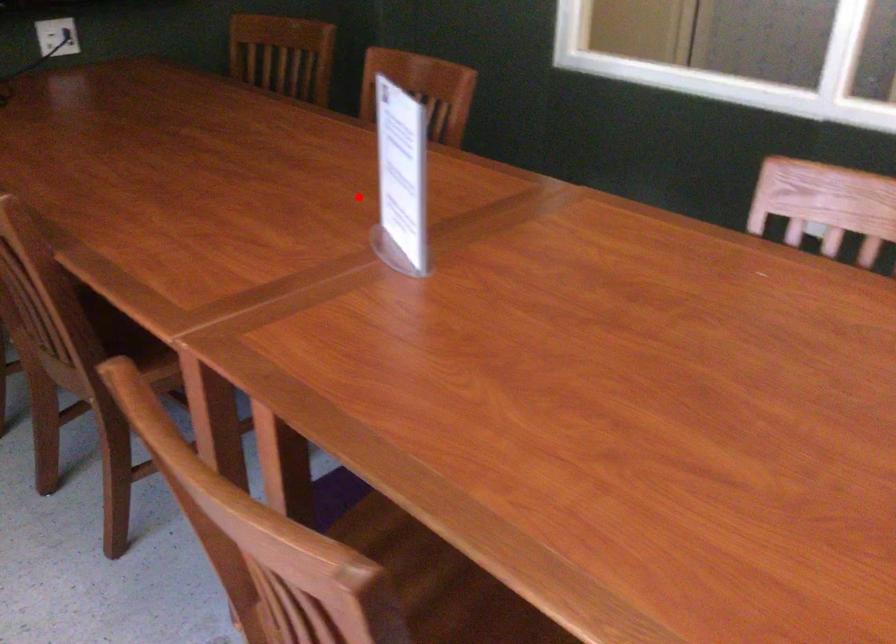
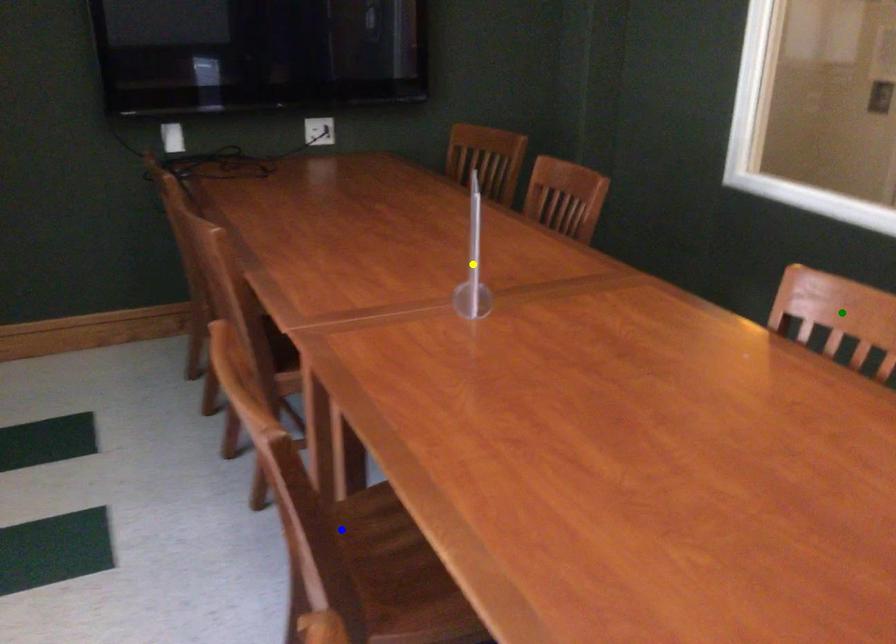
Question: I am providing you with two images of the same scene from different viewpoints. A red point is marked on the first image. You are given multiple points on the second image. Which mark in image 2 goes with the point in image 1?

Choices:
 (A) yellow point
 (B) green point
 (C) blue point

Answer: (A)